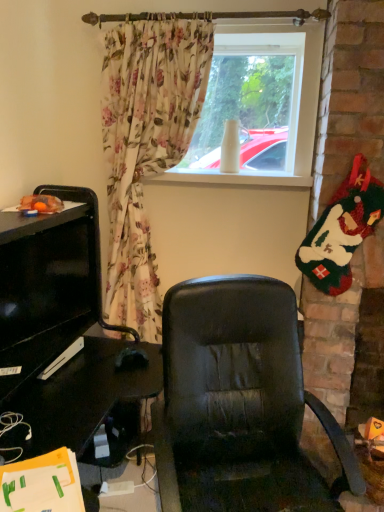
Describe the element at coordinates (131, 359) in the screenshot. This screenshot has width=384, height=512. I see `black matte mouse at lower left` at that location.

Image resolution: width=384 pixels, height=512 pixels. Identify the location of black matte mouse at lower left. (131, 359).

In order to face white matte vase at upper center, should I rotate leftwards or rightwards?

You should rotate right by 2.743 degrees.

This screenshot has height=512, width=384. What are the coordinates of `white matte vase at upper center` in the screenshot? It's located at [245, 111].

Image resolution: width=384 pixels, height=512 pixels. Describe the element at coordinates (245, 111) in the screenshot. I see `white matte vase at upper center` at that location.

Locate an element on the screen. Image resolution: width=384 pixels, height=512 pixels. black matte mouse at lower left is located at coordinates (131, 359).

Between white matte vase at upper center and black matte mouse at lower left, which one appears on the right side from the viewer's perspective?

From the viewer's perspective, white matte vase at upper center appears more on the right side.

Which object is further away from the camera taking this photo, white matte vase at upper center or black matte mouse at lower left?

white matte vase at upper center.

Is point (202, 151) positioned behind point (119, 365)?

Yes.

From the image's perspective, which one is positioned higher, white matte vase at upper center or black matte mouse at lower left?

white matte vase at upper center.

From a real-world perspective, is white matte vase at upper center above or below black matte mouse at lower left?

white matte vase at upper center is above black matte mouse at lower left.

Does white matte vase at upper center have a lesser width compared to black matte mouse at lower left?

Indeed, white matte vase at upper center has a lesser width compared to black matte mouse at lower left.

Does white matte vase at upper center have a lesser height compared to black matte mouse at lower left?

Incorrect, the height of white matte vase at upper center does not fall short of that of black matte mouse at lower left.

Consider the image. Is white matte vase at upper center bigger or smaller than black matte mouse at lower left?

In the image, white matte vase at upper center appears to be larger than black matte mouse at lower left.

Does white matte vase at upper center contain black matte mouse at lower left?

That's incorrect, black matte mouse at lower left is not inside white matte vase at upper center.

Can you see white matte vase at upper center touching black matte mouse at lower left?

They are not placed beside each other.

Could you tell me if white matte vase at upper center is facing black matte mouse at lower left?

No, white matte vase at upper center is not aimed at black matte mouse at lower left.

How many degrees apart are the facing directions of white matte vase at upper center and black matte mouse at lower left?

The angle between the facing direction of white matte vase at upper center and the facing direction of black matte mouse at lower left is 34.1 degrees.

Find the location of a particular element. mouse lying in front of the white matte vase at upper center is located at coordinates (131, 359).

Can you confirm if black matte mouse at lower left is positioned to the left of white matte vase at upper center?

Yes.

Which is in front, black matte mouse at lower left or white matte vase at upper center?

Positioned in front is black matte mouse at lower left.

Which point is more distant from viewer, (137, 357) or (211, 142)?

Point (211, 142)

From the image's perspective, between black matte mouse at lower left and white matte vase at upper center, which one is located above?

From the image's view, white matte vase at upper center is above.

From a real-world perspective, is black matte mouse at lower left above or below white matte vase at upper center?

black matte mouse at lower left is situated lower than white matte vase at upper center in the real world.

Between black matte mouse at lower left and white matte vase at upper center, which one has smaller width?

white matte vase at upper center.

Does black matte mouse at lower left have a lesser height compared to white matte vase at upper center?

Correct, black matte mouse at lower left is not as tall as white matte vase at upper center.

Can you confirm if black matte mouse at lower left is smaller than white matte vase at upper center?

Indeed, black matte mouse at lower left has a smaller size compared to white matte vase at upper center.

Is black matte mouse at lower left outside of white matte vase at upper center?

Yes.

Is black matte mouse at lower left next to white matte vase at upper center and touching it?

black matte mouse at lower left is not next to white matte vase at upper center, and they're not touching.

From the picture: Is black matte mouse at lower left facing towards white matte vase at upper center?

No, black matte mouse at lower left does not turn towards white matte vase at upper center.

How different are the orientations of black matte mouse at lower left and white matte vase at upper center in degrees?

34.1 degrees.

Locate an element on the screen. The image size is (384, 512). mouse lying in front of the white matte vase at upper center is located at coordinates (131, 359).

Identify the location of window screen located above the black matte mouse at lower left (from the image's perspective). (245, 111).

The width and height of the screenshot is (384, 512). I want to click on mouse located in front of the white matte vase at upper center, so click(x=131, y=359).